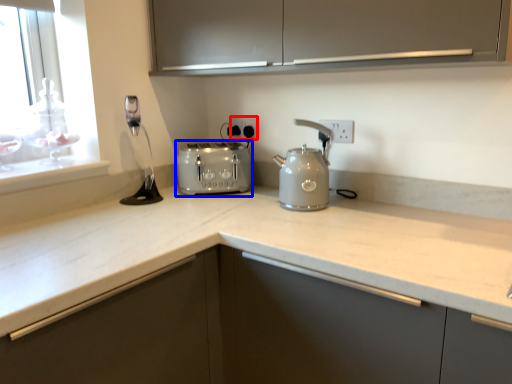
Question: Among these objects, which one is farthest to the camera, electric outlet (highlighted by a red box) or toaster (highlighted by a blue box)?

Choices:
 (A) electric outlet
 (B) toaster

Answer: (A)